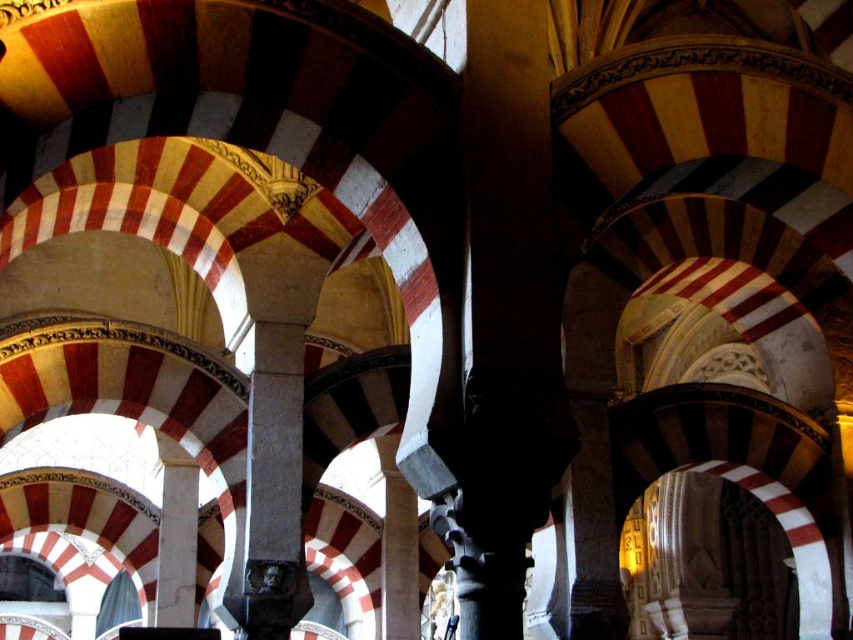
You are an architect analyzing the structural integrity of the columns in this historical building. Given that the black polished stone column at center is positioned over the dark gray stone column at center, which column would you prioritize inspecting for potential load distribution issues and why?

The black polished stone column at center would be prioritized for inspection because it is positioned over the dark gray stone column at center, meaning it bears the weight above it, making it critical to ensure it can handle the structural load without compromising the building.